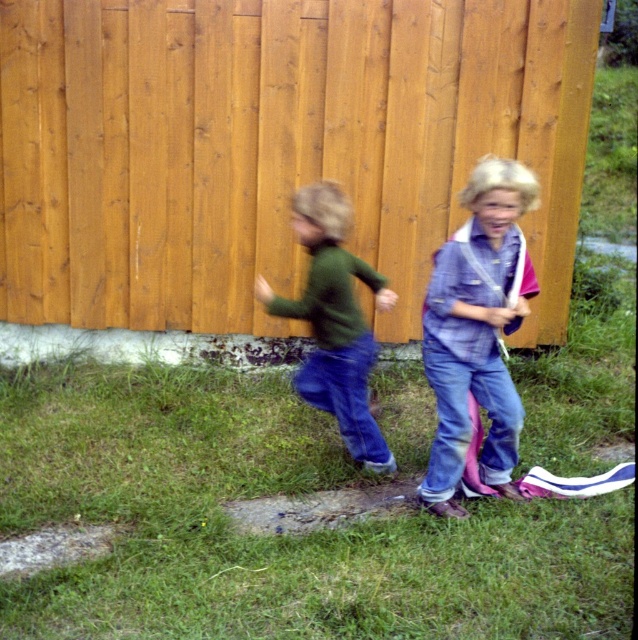
Question: Does wooden fence at center have a smaller size compared to green grass at lower center?

Choices:
 (A) no
 (B) yes

Answer: (B)

Question: Which of the following is the closest to the observer?

Choices:
 (A) denim jeans at right
 (B) wooden fence at center
 (C) green matte shirt at center

Answer: (A)

Question: Which object appears farthest from the camera in this image?

Choices:
 (A) green grass at lower center
 (B) wooden fence at center
 (C) green matte shirt at center

Answer: (B)

Question: Is denim jeans at right above green matte shirt at center?

Choices:
 (A) yes
 (B) no

Answer: (B)

Question: Which point is closer to the camera?

Choices:
 (A) (431, 403)
 (B) (487, 369)

Answer: (B)

Question: Is wooden fence at center to the left of green grass at lower center from the viewer's perspective?

Choices:
 (A) yes
 (B) no

Answer: (B)